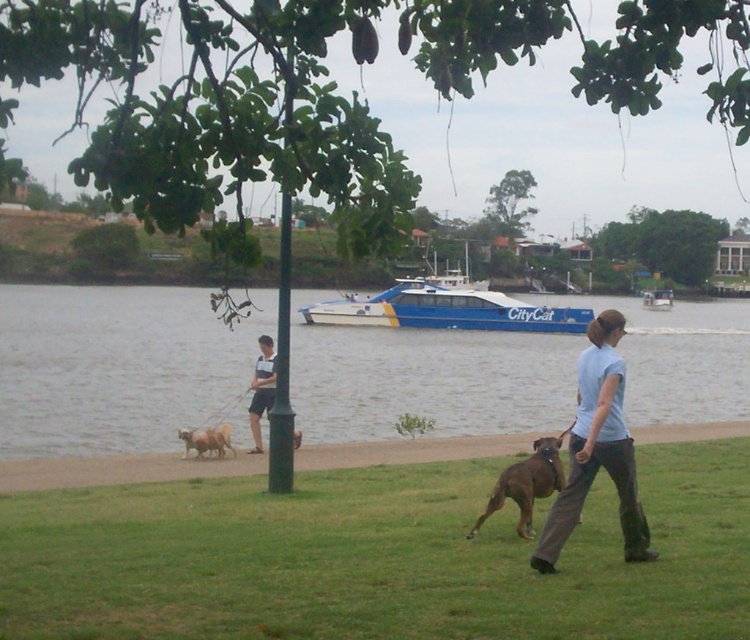
Is point (622, 538) positioned before point (210, 428)?

Yes, point (622, 538) is in front of point (210, 428).

Does light blue shirt at center appear on the right side of white fur dog at lower left?

Yes, light blue shirt at center is to the right of white fur dog at lower left.

Is point (543, 570) positioned in front of point (206, 448)?

That is True.

The width and height of the screenshot is (750, 640). What are the coordinates of `light blue shirt at center` in the screenshot? It's located at (597, 449).

Which is more to the left, green grass at lower center or white fur dog at lower left?

white fur dog at lower left is more to the left.

Who is more forward, (237, 548) or (224, 429)?

Point (237, 548) is more forward.

The height and width of the screenshot is (640, 750). Find the location of `green grass at lower center`. green grass at lower center is located at coordinates (376, 557).

Looking at this image, between blue/white water at center and brown leather dog at lower center, which one appears on the left side from the viewer's perspective?

From the viewer's perspective, blue/white water at center appears more on the left side.

How distant is blue/white water at center from brown leather dog at lower center?

blue/white water at center and brown leather dog at lower center are 38.46 meters apart from each other.

Where is `blue/white water at center`? Image resolution: width=750 pixels, height=640 pixels. blue/white water at center is located at coordinates (116, 365).

Locate an element on the screen. blue/white water at center is located at coordinates (116, 365).